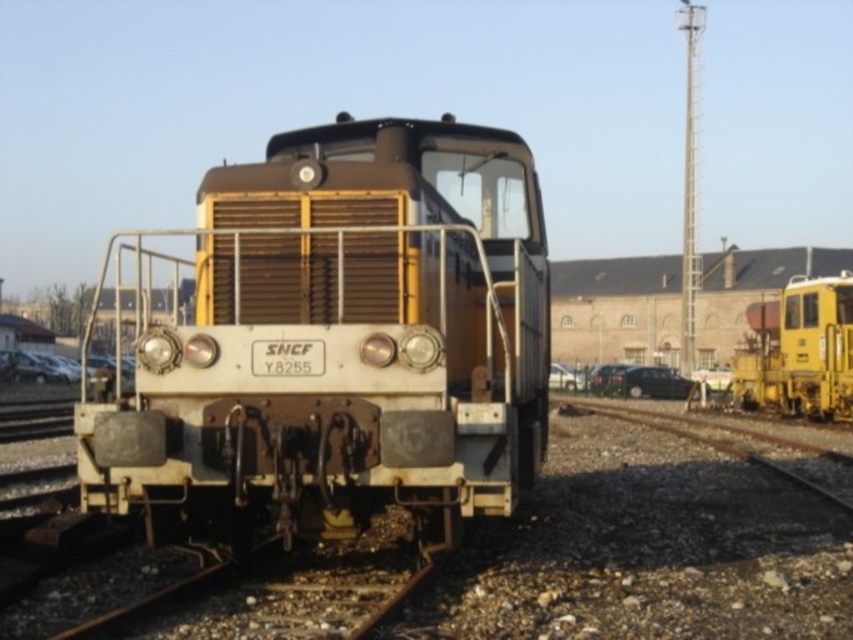
Question: Is yellow matte train at center below yellow matte train at right?

Choices:
 (A) no
 (B) yes

Answer: (A)

Question: Does yellow matte train at center appear on the right side of yellow matte train at right?

Choices:
 (A) no
 (B) yes

Answer: (A)

Question: Considering the relative positions of yellow matte train at center and yellow matte train at right in the image provided, where is yellow matte train at center located with respect to yellow matte train at right?

Choices:
 (A) above
 (B) below

Answer: (A)

Question: Among these points, which one is farthest from the camera?

Choices:
 (A) (525, 243)
 (B) (833, 301)

Answer: (B)